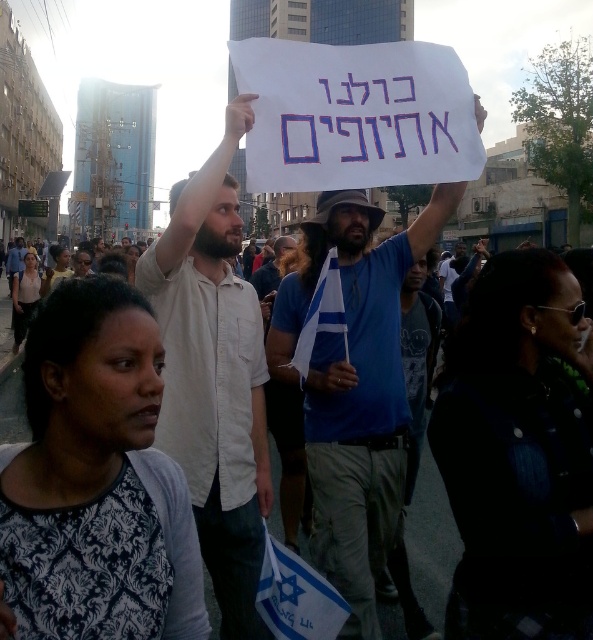
Based on the scene description, where exactly is the white shirt at upper center located in the image?

The white shirt at upper center is located at point (215, 376).

You are a photographer at the protest scene. You need to capture a photo that includes both the white shirt at upper center and the blue cotton shirt at center. Which of the two shirts should you focus on to ensure both are clearly visible in the frame?

The white shirt at upper center occupies less space than the blue cotton shirt at center, so focusing on the blue cotton shirt at center would allow both shirts to be clearly visible in the frame.

You are a photographer at the protest scene. You want to take a photo that includes both the man holding the white sign and the person with the Israeli flag. The man holding the white sign is at point (216, 248) and the person with the Israeli flag is at point (352, 573). Based on their positions, which person should you focus on first to ensure both are in the frame?

Point (216, 248) is behind point (352, 573), so you should focus on the person with the Israeli flag at point (352, 573) first to ensure both are in the frame.